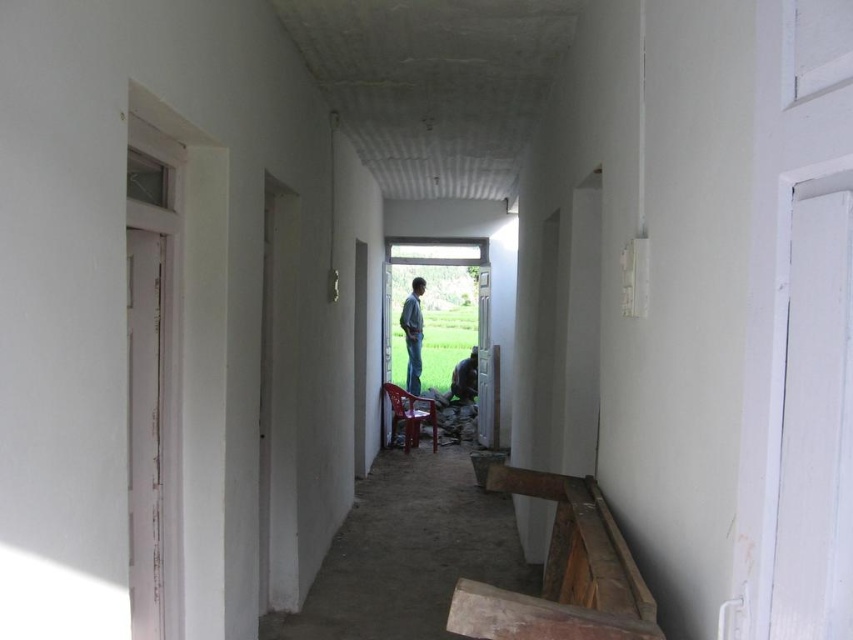
You are standing in the corridor and notice two items at the center. Which one is higher up, the blue denim jeans at center or the dark brown leather jacket at center?

The blue denim jeans at center is located above the dark brown leather jacket at center, so it is higher up.